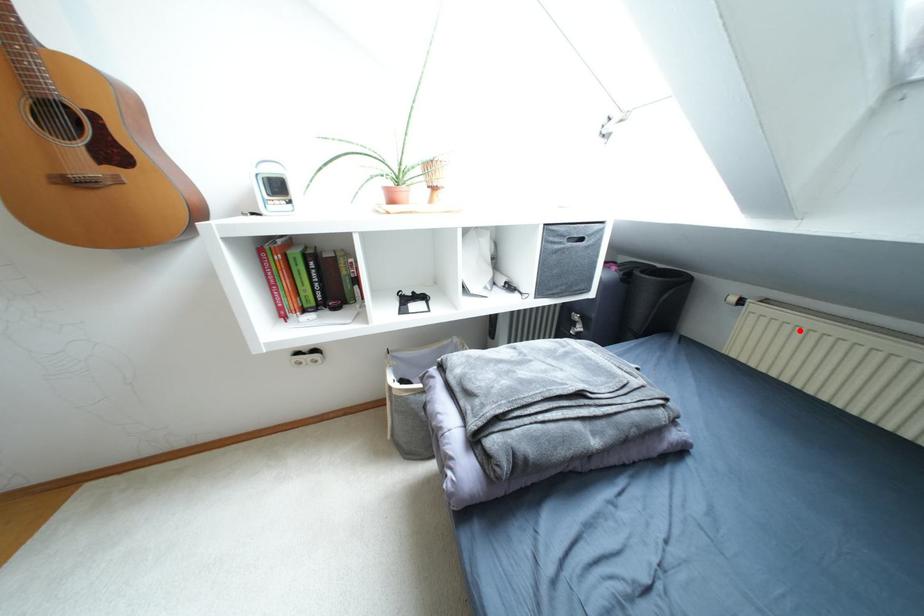
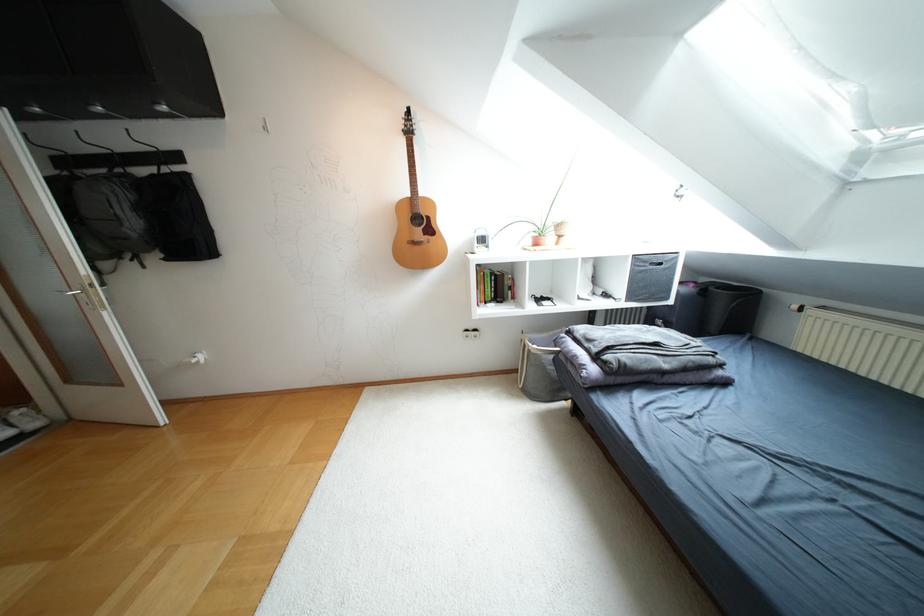
Locate, in the second image, the point that corresponds to the highlighted location in the first image.

(847, 326)